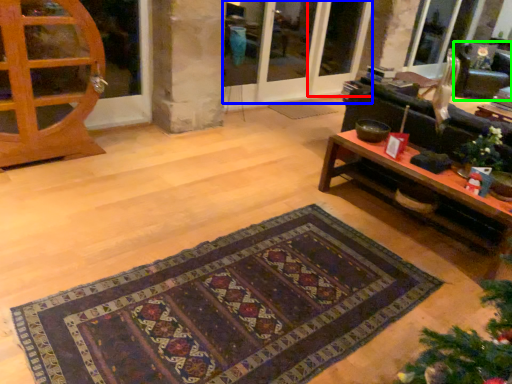
Question: Which is farther away from screen door (highlighted by a red box)? screen door (highlighted by a blue box) or armchair (highlighted by a green box)?

Choices:
 (A) screen door
 (B) armchair

Answer: (B)